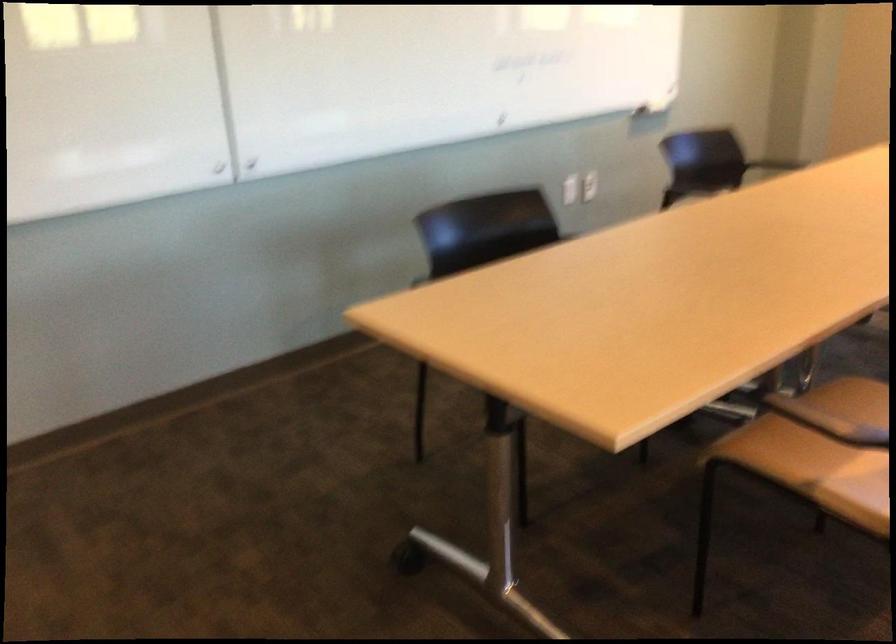
Where would you sitting on the brown chair sitting surface? Please return your answer as a coordinate pair (x, y).

(830, 420)